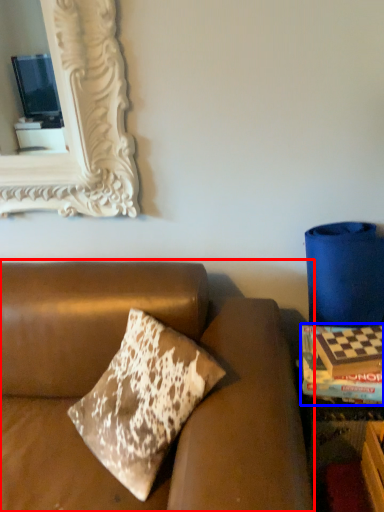
Question: Which object is further to the camera taking this photo, studio couch (highlighted by a red box) or magazine (highlighted by a blue box)?

Choices:
 (A) studio couch
 (B) magazine

Answer: (B)